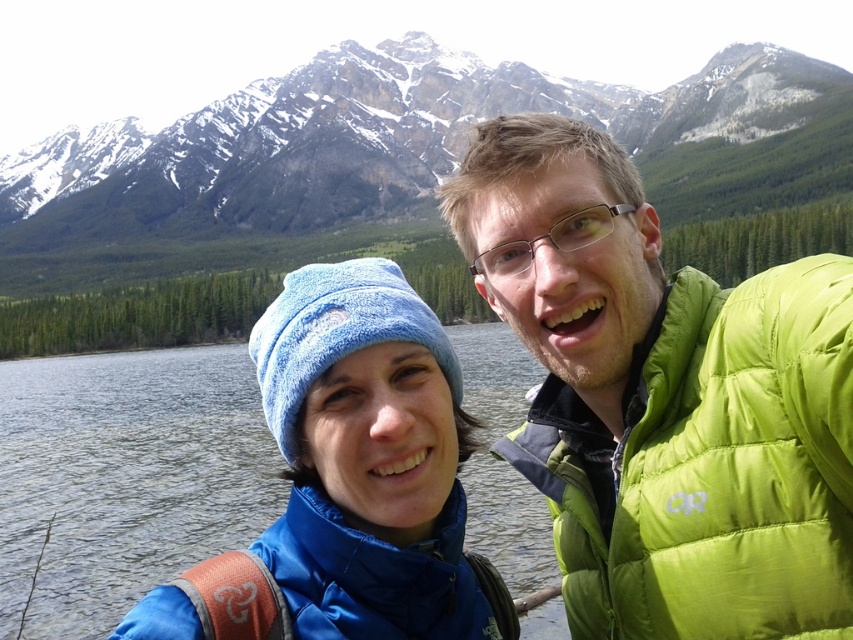
Question: Observing the image, what is the correct spatial positioning of blue fleece jacket at center in reference to blue synthetic down jacket at lower left?

Choices:
 (A) right
 (B) left

Answer: (B)

Question: Estimate the real-world distances between objects in this image. Which object is closer to the blue fleece jacket at center?

Choices:
 (A) lime green puffer jacket at upper right
 (B) snowy rock mountain at upper center

Answer: (A)

Question: Does snowy rock mountain at upper center have a smaller size compared to blue fleece jacket at center?

Choices:
 (A) yes
 (B) no

Answer: (B)

Question: Estimate the real-world distances between objects in this image. Which object is farther from the blue fleece jacket at center?

Choices:
 (A) blue synthetic down jacket at lower left
 (B) snowy rock mountain at upper center

Answer: (B)

Question: Is lime green puffer jacket at upper right positioned at the back of blue fleece jacket at center?

Choices:
 (A) yes
 (B) no

Answer: (B)

Question: Which point appears farthest from the camera in this image?

Choices:
 (A) (282, 141)
 (B) (352, 496)

Answer: (A)